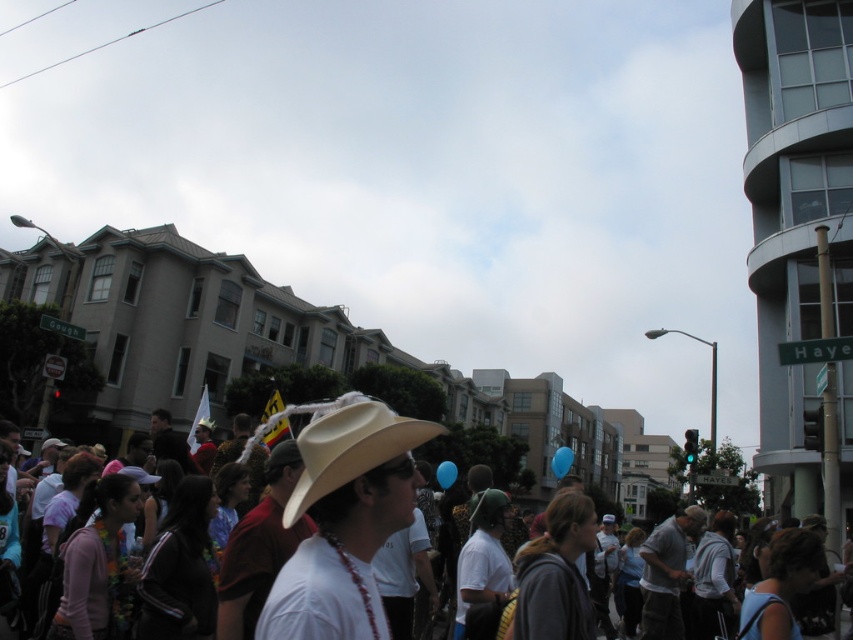
Between white matte cowboy hat at center and beige felt cowboy hat at center, which one appears on the right side from the viewer's perspective?

From the viewer's perspective, white matte cowboy hat at center appears more on the right side.

Can you confirm if white matte cowboy hat at center is thinner than beige felt cowboy hat at center?

Incorrect, white matte cowboy hat at center's width is not less than beige felt cowboy hat at center's.

Is point (55, 486) behind point (395, 454)?

Yes, point (55, 486) is behind point (395, 454).

This screenshot has height=640, width=853. I want to click on white matte cowboy hat at center, so click(x=78, y=484).